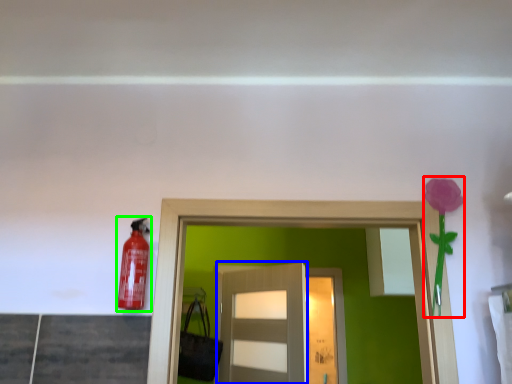
Question: Which is nearer to the flower (highlighted by a red box)? door (highlighted by a blue box) or extinguisher (highlighted by a green box).

Choices:
 (A) door
 (B) extinguisher

Answer: (B)